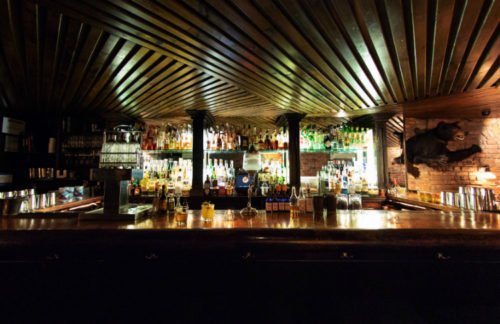
The image size is (500, 324). I want to click on lights, so click(455, 179).